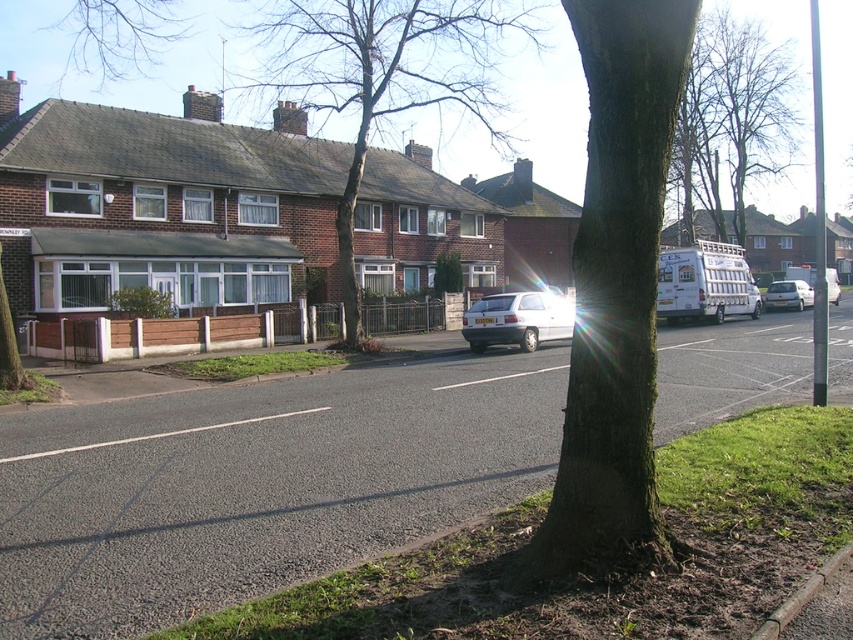
Between brown bark tree at upper left and white matte van at right, which one appears on the left side from the viewer's perspective?

From the viewer's perspective, brown bark tree at upper left appears more on the left side.

Which of these two, brown bark tree at upper left or white matte van at right, stands shorter?

white matte van at right is shorter.

This screenshot has width=853, height=640. Describe the element at coordinates (119, 36) in the screenshot. I see `brown bark tree at upper left` at that location.

Find the location of a particular element. The width and height of the screenshot is (853, 640). brown bark tree at upper left is located at coordinates (119, 36).

Is green mossy tree trunk at center positioned at the back of brown textured tree at center?

No.

What do you see at coordinates (614, 300) in the screenshot? The image size is (853, 640). I see `green mossy tree trunk at center` at bounding box center [614, 300].

Where is `green mossy tree trunk at center`? green mossy tree trunk at center is located at coordinates (614, 300).

Can you confirm if silver metallic hatchback at center is taller than white matte van at right?

Indeed, silver metallic hatchback at center has a greater height compared to white matte van at right.

Is silver metallic hatchback at center to the right of white matte van at right from the viewer's perspective?

No, silver metallic hatchback at center is not to the right of white matte van at right.

This screenshot has width=853, height=640. Describe the element at coordinates (517, 320) in the screenshot. I see `silver metallic hatchback at center` at that location.

I want to click on silver metallic hatchback at center, so click(x=517, y=320).